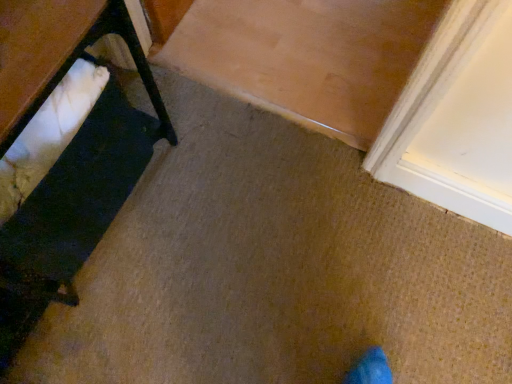
Question: From their relative heights in the image, would you say white fabric at left is taller or shorter than white fabric cushion at left?

Choices:
 (A) short
 (B) tall

Answer: (A)

Question: Based on their sizes in the image, would you say white fabric at left is bigger or smaller than white fabric cushion at left?

Choices:
 (A) small
 (B) big

Answer: (A)

Question: Is white fabric at left in front of or behind white fabric cushion at left in the image?

Choices:
 (A) front
 (B) behind

Answer: (A)

Question: From a real-world perspective, is white fabric cushion at left positioned above or below white fabric at left?

Choices:
 (A) above
 (B) below

Answer: (B)

Question: Is white fabric cushion at left in front of or behind white fabric at left in the image?

Choices:
 (A) front
 (B) behind

Answer: (B)

Question: From the image's perspective, is white fabric cushion at left positioned above or below white fabric at left?

Choices:
 (A) below
 (B) above

Answer: (A)

Question: Looking at the image, does white fabric cushion at left seem bigger or smaller compared to white fabric at left?

Choices:
 (A) big
 (B) small

Answer: (A)